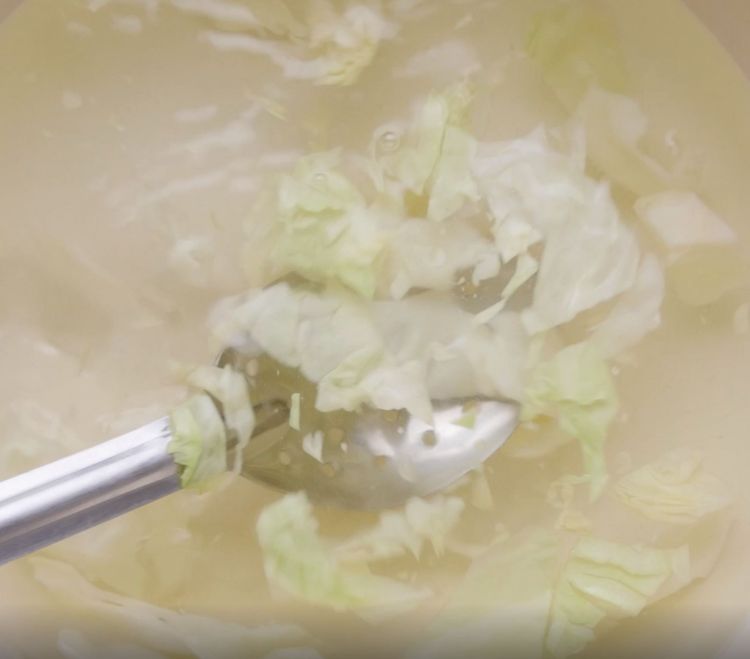
The image size is (750, 659). I want to click on table behind the bowl, so pos(730,14), pos(741,38).